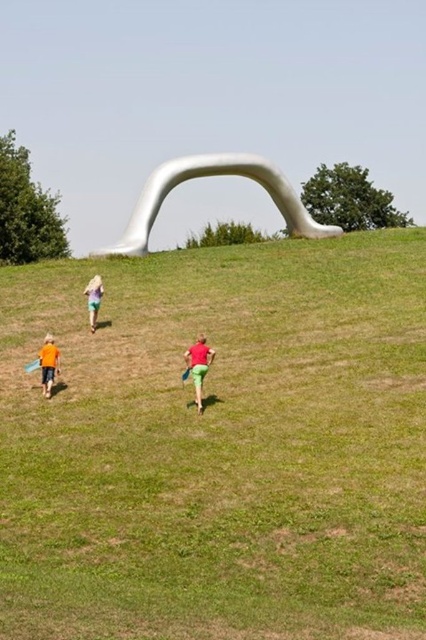
Is white matte arch at center above matte pink shirt at center?

Yes, white matte arch at center is above matte pink shirt at center.

Does point (141, 253) come in front of point (201, 340)?

No, (141, 253) is further to viewer.

At what (x,y) coordinates should I click in order to perform the action: click on white matte arch at center. Please return your answer as a coordinate pair (x, y). Image resolution: width=426 pixels, height=640 pixels. Looking at the image, I should click on (213, 176).

The image size is (426, 640). Describe the element at coordinates (213, 176) in the screenshot. I see `white matte arch at center` at that location.

The height and width of the screenshot is (640, 426). In order to click on white matte arch at center in this screenshot , I will do `click(213, 176)`.

You are a GUI agent. You are given a task and a screenshot of the screen. Output one action in this format:
    pyautogui.click(x=<x>, y=<y>)
    Task: Click on the white matte arch at center
    This screenshot has height=640, width=426.
    Given the screenshot: What is the action you would take?
    pyautogui.click(x=213, y=176)

Is green grassy field at center positioned before white matte arch at center?

Yes, it is.

Locate an element on the screen. This screenshot has width=426, height=640. green grassy field at center is located at coordinates (218, 445).